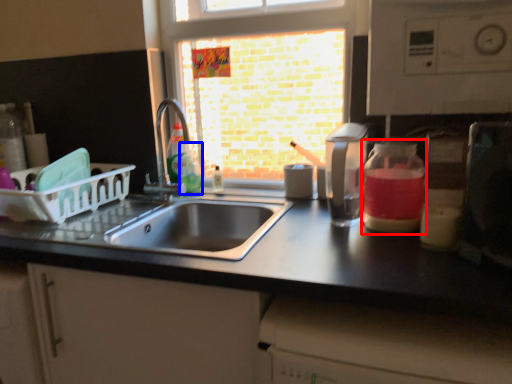
Question: Which object is closer to the camera taking this photo, glass jar (highlighted by a red box) or bottle (highlighted by a blue box)?

Choices:
 (A) glass jar
 (B) bottle

Answer: (A)